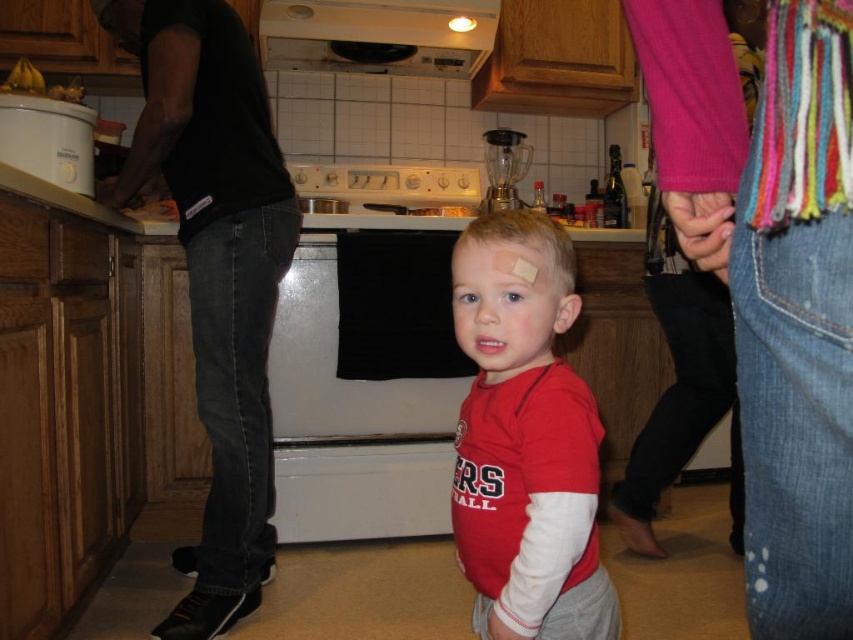
Which is above, white glossy oven at center or white glossy stove at center?

Positioned higher is white glossy stove at center.

Can you confirm if white glossy oven at center is taller than white glossy stove at center?

Yes, white glossy oven at center is taller than white glossy stove at center.

The width and height of the screenshot is (853, 640). What do you see at coordinates (364, 392) in the screenshot?
I see `white glossy oven at center` at bounding box center [364, 392].

You are a GUI agent. You are given a task and a screenshot of the screen. Output one action in this format:
    pyautogui.click(x=<x>, y=<y>)
    Task: Click on the white glossy oven at center
    Image resolution: width=853 pixels, height=640 pixels.
    Given the screenshot: What is the action you would take?
    pyautogui.click(x=364, y=392)

Is the position of red matte shirt at center more distant than that of white glossy stove at center?

That is False.

Which is more to the right, red matte shirt at center or white glossy stove at center?

red matte shirt at center

Does point (585, 572) come behind point (447, 173)?

No, (585, 572) is closer to viewer.

Find the location of a particular element. The width and height of the screenshot is (853, 640). red matte shirt at center is located at coordinates (525, 438).

Consider the image. Can you confirm if white matte exhaust hood at upper center is taller than white glossy stove at center?

No.

Is white matte exhaust hood at upper center behind white glossy stove at center?

That is False.

The width and height of the screenshot is (853, 640). Describe the element at coordinates (376, 35) in the screenshot. I see `white matte exhaust hood at upper center` at that location.

The width and height of the screenshot is (853, 640). In order to click on white matte exhaust hood at upper center in this screenshot , I will do `click(376, 35)`.